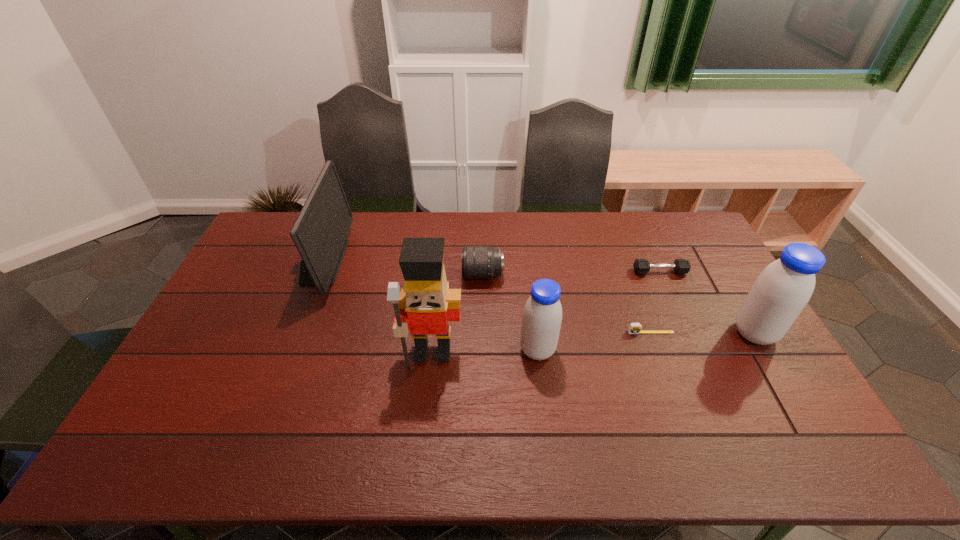
The image size is (960, 540). What are the coordinates of `vacant point located between the second shortest object and the telephoto lens` in the screenshot? It's located at (571, 273).

Identify the location of free space between the tape measure and the computer monitor. The width and height of the screenshot is (960, 540). pos(487,297).

Locate an element on the screen. empty location between the left soya milk and the right soya milk is located at coordinates (646, 342).

I want to click on object that is the fifth closest to the rightmost object, so click(x=426, y=305).

Identify which object is the fifth closest to the taller soya milk. Please provide its 2D coordinates. Your answer should be formatted as a tuple, i.e. [(x, y)], where the tuple contains the x and y coordinates of a point satisfying the conditions above.

[(426, 305)]

Find the location of a particular element. free space that satisfies the following two spatial constraints: 1. on the surface of the telephoto lens; 2. in front of the nutcracker holding the staff is located at coordinates (483, 352).

Where is `vacant space that satisfies the following two spatial constraints: 1. on the screen side of the sixth tallest object; 2. on the left side of the leftmost object`? vacant space that satisfies the following two spatial constraints: 1. on the screen side of the sixth tallest object; 2. on the left side of the leftmost object is located at coordinates (319, 272).